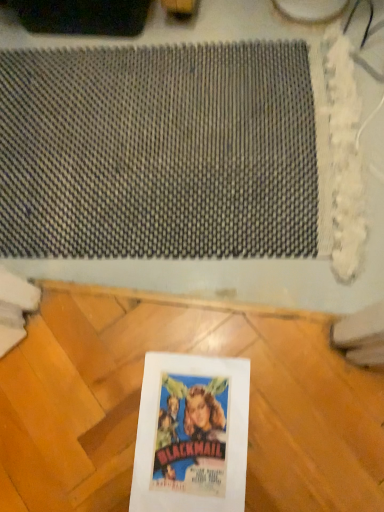
The width and height of the screenshot is (384, 512). What do you see at coordinates (191, 434) in the screenshot?
I see `white paper at center` at bounding box center [191, 434].

Find the location of a particular element. This screenshot has width=384, height=512. white paper at center is located at coordinates (191, 434).

Where is `textured gray mat at upper center`? The image size is (384, 512). textured gray mat at upper center is located at coordinates (162, 153).

What do you see at coordinates (162, 153) in the screenshot? I see `textured gray mat at upper center` at bounding box center [162, 153].

What are the coordinates of `white paper at center` in the screenshot? It's located at (191, 434).

Considering the relative positions of textured gray mat at upper center and white paper at center in the image provided, is textured gray mat at upper center to the left of white paper at center from the viewer's perspective?

Indeed, textured gray mat at upper center is positioned on the left side of white paper at center.

Between textured gray mat at upper center and white paper at center, which one is positioned behind?

textured gray mat at upper center is further away from the camera.

Is point (137, 180) positioned after point (137, 480)?

Yes, point (137, 180) is behind point (137, 480).

In the scene shown: From the image's perspective, between textured gray mat at upper center and white paper at center, which one is located above?

textured gray mat at upper center is shown above in the image.

From a real-world perspective, between textured gray mat at upper center and white paper at center, who is vertically lower?

In real-world perspective, textured gray mat at upper center is lower.

In terms of width, does textured gray mat at upper center look wider or thinner when compared to white paper at center?

textured gray mat at upper center is wider than white paper at center.

Which of these two, textured gray mat at upper center or white paper at center, stands taller?

Standing taller between the two is textured gray mat at upper center.

From the picture: Based on their sizes in the image, would you say textured gray mat at upper center is bigger or smaller than white paper at center?

In the image, textured gray mat at upper center appears to be larger than white paper at center.

Is white paper at center a part of textured gray mat at upper center?

Actually, white paper at center is outside textured gray mat at upper center.

Is textured gray mat at upper center positioned far away from white paper at center?

textured gray mat at upper center is near white paper at center, not far away.

Could you tell me if textured gray mat at upper center is turned towards white paper at center?

No, textured gray mat at upper center is not turned towards white paper at center.

Where is `picture frame on the right of textured gray mat at upper center`? picture frame on the right of textured gray mat at upper center is located at coordinates (191, 434).

Looking at this image, based on their positions, is white paper at center located to the left or right of textured gray mat at upper center?

white paper at center is to the right of textured gray mat at upper center.

Who is more distant, white paper at center or textured gray mat at upper center?

textured gray mat at upper center is more distant.

Which is behind, point (241, 489) or point (277, 112)?

The point (277, 112) is farther from the camera.

From the image's perspective, is white paper at center over textured gray mat at upper center?

No, from the image's perspective, white paper at center is not over textured gray mat at upper center.

Consider the image. From a real-world perspective, is white paper at center under textured gray mat at upper center?

Incorrect, from a real-world perspective, white paper at center is higher than textured gray mat at upper center.

Does white paper at center have a greater width compared to textured gray mat at upper center?

No.

Does white paper at center have a lesser height compared to textured gray mat at upper center?

Yes, white paper at center is shorter than textured gray mat at upper center.

Which of these two, white paper at center or textured gray mat at upper center, is bigger?

With larger size is textured gray mat at upper center.

Which is correct: white paper at center is inside textured gray mat at upper center, or outside of it?

white paper at center exists outside the volume of textured gray mat at upper center.

Are white paper at center and textured gray mat at upper center far apart?

white paper at center is actually quite close to textured gray mat at upper center.

Is white paper at center positioned with its back to textured gray mat at upper center?

No.

Where is `mat behind the white paper at center`? mat behind the white paper at center is located at coordinates (162, 153).

You are a GUI agent. You are given a task and a screenshot of the screen. Output one action in this format:
    pyautogui.click(x=<x>, y=<y>)
    Task: Click on the mat on the left side of white paper at center
    Image resolution: width=384 pixels, height=512 pixels.
    Given the screenshot: What is the action you would take?
    pyautogui.click(x=162, y=153)

Locate an element on the screen. Image resolution: width=384 pixels, height=512 pixels. picture frame located on the right of textured gray mat at upper center is located at coordinates (191, 434).